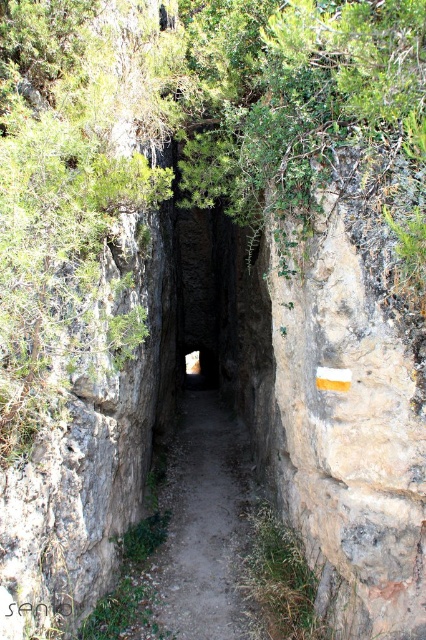
Image resolution: width=426 pixels, height=640 pixels. What do you see at coordinates (189, 140) in the screenshot? I see `green leafy tree at upper center` at bounding box center [189, 140].

Between green leafy tree at upper center and dirt path at center, which one appears on the left side from the viewer's perspective?

dirt path at center is more to the left.

Who is more forward, [258,17] or [172,563]?

Point [258,17] is more forward.

This screenshot has width=426, height=640. Find the location of `green leafy tree at upper center`. green leafy tree at upper center is located at coordinates (189, 140).